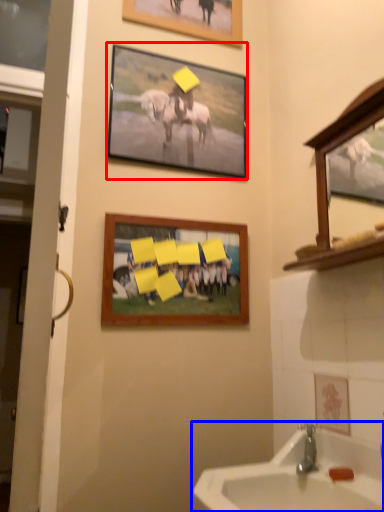
Question: Which object appears farthest to the camera in this image, picture frame (highlighted by a red box) or sink (highlighted by a blue box)?

Choices:
 (A) picture frame
 (B) sink

Answer: (A)